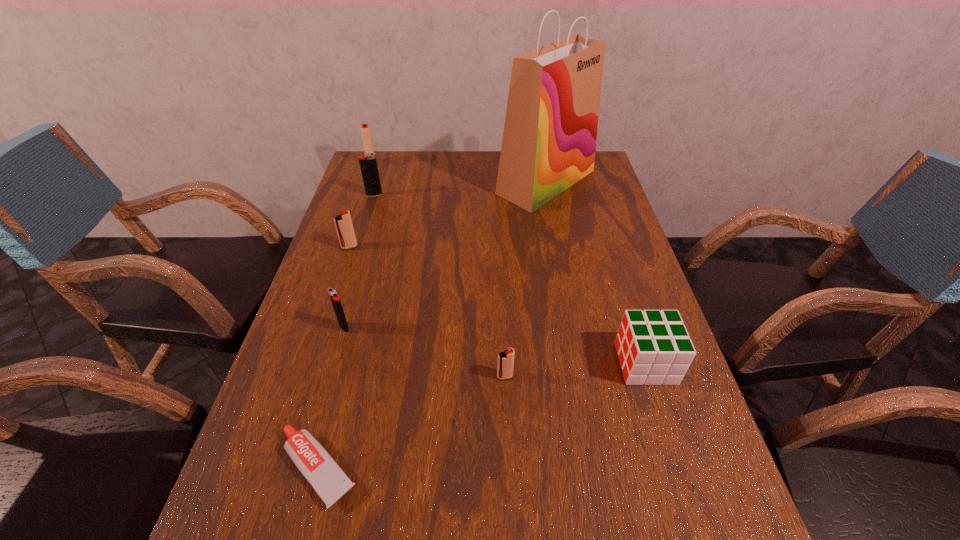
This screenshot has height=540, width=960. I want to click on the rightmost red igniter, so click(x=505, y=366).

Where is `the nearest red igniter`? the nearest red igniter is located at coordinates (505, 366).

Where is `the shortest object`? the shortest object is located at coordinates (329, 481).

Locate an element on the screen. toothpaste is located at coordinates (329, 481).

Locate an element on the screen. This screenshot has width=960, height=540. vacant space located 0.210m on the front of the shopping bag is located at coordinates (562, 258).

This screenshot has height=540, width=960. Identify the location of vacant space situated 0.210m on the right of the farthest igniter. (436, 164).

Locate an element on the screen. free spot located 0.140m on the back of the fourth nearest igniter is located at coordinates (382, 171).

Locate an element on the screen. The image size is (960, 540). blank space located 0.070m on the front of the smaller black igniter is located at coordinates (335, 358).

Locate an element on the screen. The width and height of the screenshot is (960, 540). free spot located 0.200m on the front of the second biggest red igniter is located at coordinates (331, 303).

This screenshot has height=540, width=960. In order to click on blank space located on the red face of the red cube in this screenshot , I will do `click(441, 363)`.